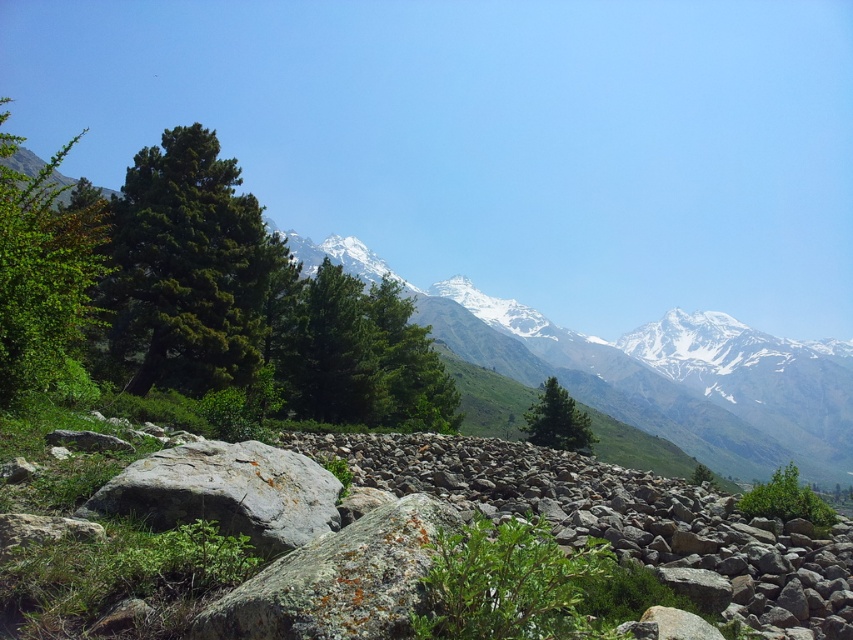
You are standing at the point labeled as point (x=44, y=276) in the image. Looking around, you see a green leafy tree at left. What direction should you face to see the green leafy tree at left?

You should face towards the left direction to see the green leafy tree at left since the point (x=44, y=276) corresponds to the green leafy tree at left.

You are a hiker trying to navigate through the rocky terrain. You notice the green matte tree at left and the green leafy tree at lower right. Which tree would you choose as a landmark if you want to mark a narrow path that requires a wider reference point?

The green leafy tree at lower right is wider than the green matte tree at left, so it would be a better landmark for marking a narrow path that needs a wider reference point.

You are hiking in the mountainous landscape and want to take a photo of both the green leafy tree at left and the green leafy tree at lower right. Which tree should you focus on first to ensure both are in the frame?

You should focus on the green leafy tree at left first because it is closer to the viewer, allowing you to adjust the camera to include both trees in the frame.